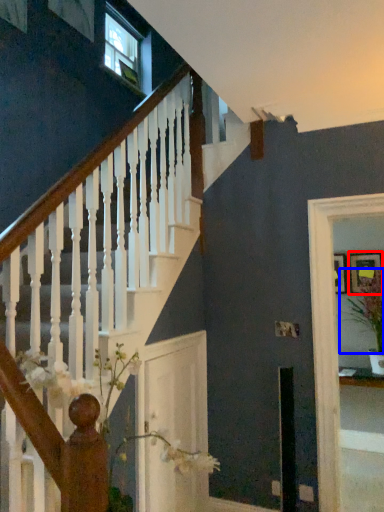
Question: Which object is closer to the camera taking this photo, picture frame (highlighted by a red box) or plant (highlighted by a blue box)?

Choices:
 (A) picture frame
 (B) plant

Answer: (B)